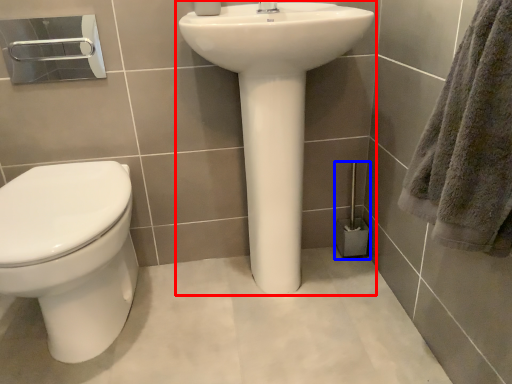
Question: Among these objects, which one is farthest to the camera, sink (highlighted by a red box) or brush (highlighted by a blue box)?

Choices:
 (A) sink
 (B) brush

Answer: (B)